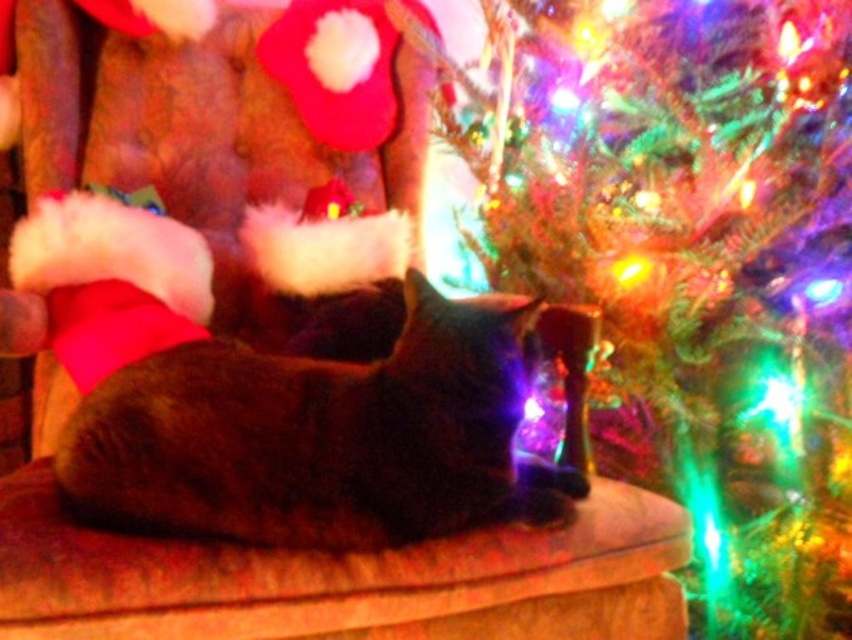
In the scene shown: Who is taller, shiny green needles at upper right or dark brown fur cat at center?

shiny green needles at upper right

Is shiny green needles at upper right wider than dark brown fur cat at center?

In fact, shiny green needles at upper right might be narrower than dark brown fur cat at center.

Describe the element at coordinates (695, 264) in the screenshot. I see `shiny green needles at upper right` at that location.

Find the location of `shiny green needles at upper right`. shiny green needles at upper right is located at coordinates (695, 264).